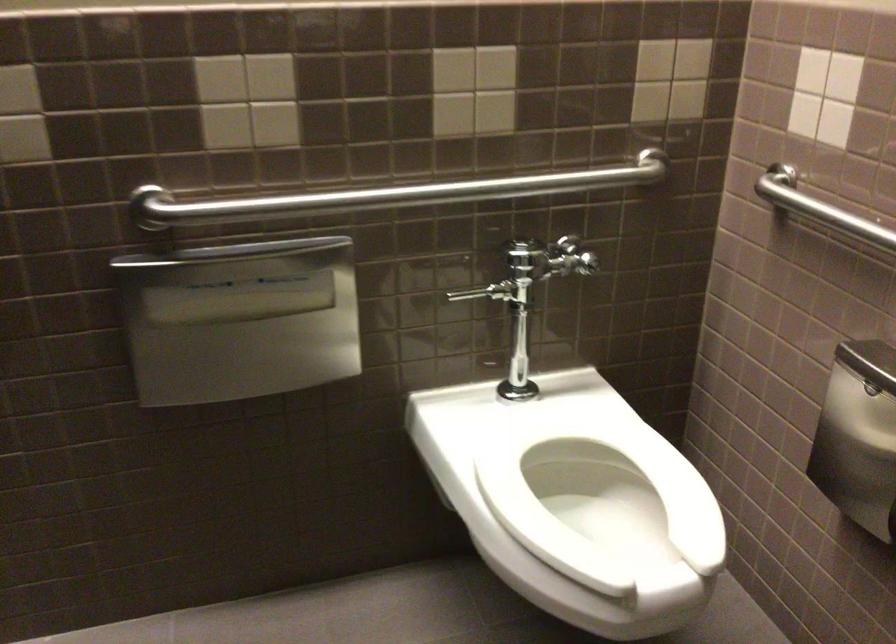
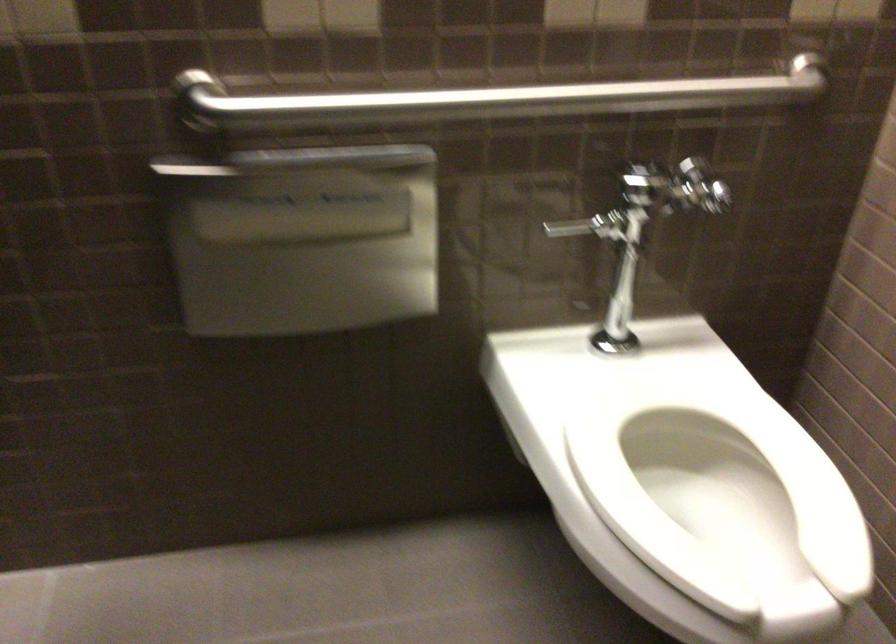
Find the pixel in the second image that matches pixel 486 290 in the first image.

(589, 225)